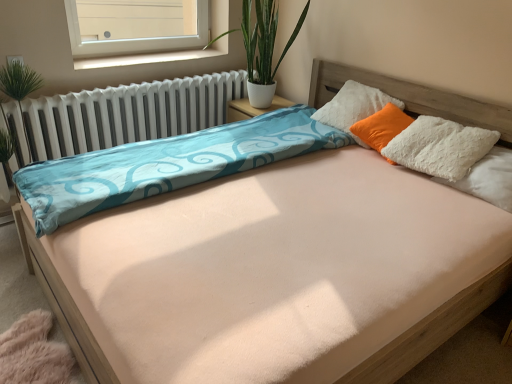
Question: Is white fluffy pillow at upper right, placed as the first pillow when sorted from back to front, oriented away from green leafy plant at upper center?

Choices:
 (A) yes
 (B) no

Answer: (B)

Question: Does white fluffy pillow at upper right, the second pillow from the right, come in front of green leafy plant at upper center?

Choices:
 (A) no
 (B) yes

Answer: (B)

Question: Is white fluffy pillow at upper right, the second pillow from the right, taller than green leafy plant at upper center?

Choices:
 (A) no
 (B) yes

Answer: (A)

Question: From a real-world perspective, is white fluffy pillow at upper right, which is counted as the first pillow, starting from the left, physically below green leafy plant at upper center?

Choices:
 (A) yes
 (B) no

Answer: (A)

Question: Is white fluffy pillow at upper right, which is counted as the first pillow, starting from the left, smaller than green leafy plant at upper center?

Choices:
 (A) yes
 (B) no

Answer: (A)

Question: Considering the positions of point (87, 52) and point (176, 57), is point (87, 52) closer or farther from the camera than point (176, 57)?

Choices:
 (A) farther
 (B) closer

Answer: (B)

Question: Is white plastic window at upper left bigger or smaller than white plastic window sill at upper center?

Choices:
 (A) big
 (B) small

Answer: (A)

Question: From the image's perspective, is white plastic window at upper left above or below white plastic window sill at upper center?

Choices:
 (A) above
 (B) below

Answer: (A)

Question: Is white plastic window at upper left situated inside white plastic window sill at upper center or outside?

Choices:
 (A) outside
 (B) inside

Answer: (A)

Question: Relative to white fluffy pillow at upper right, arranged as the second pillow when viewed from the front, is white plastic window at upper left in front or behind?

Choices:
 (A) front
 (B) behind

Answer: (B)

Question: From the image's perspective, is white plastic window at upper left positioned above or below white fluffy pillow at upper right, placed as the first pillow when sorted from back to front?

Choices:
 (A) above
 (B) below

Answer: (A)

Question: In terms of size, does white plastic window at upper left appear bigger or smaller than white fluffy pillow at upper right, placed as the first pillow when sorted from back to front?

Choices:
 (A) small
 (B) big

Answer: (A)

Question: From a real-world perspective, is white plastic window at upper left positioned above or below white fluffy pillow at upper right, placed as the first pillow when sorted from back to front?

Choices:
 (A) above
 (B) below

Answer: (A)

Question: From a real-world perspective, is white fluffy pillow at upper right, the first pillow positioned from the right, physically located above or below white plastic window sill at upper center?

Choices:
 (A) above
 (B) below

Answer: (B)

Question: From the image's perspective, is white fluffy pillow at upper right, the first pillow positioned from the right, above or below white plastic window sill at upper center?

Choices:
 (A) above
 (B) below

Answer: (B)